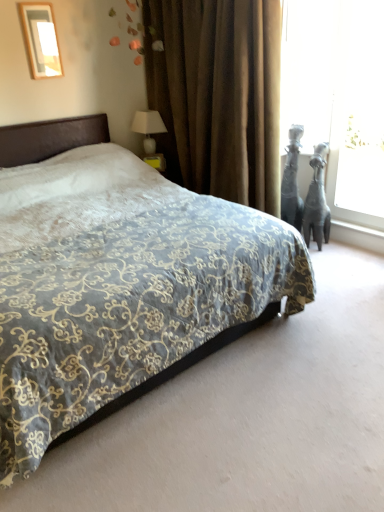
Question: From a real-world perspective, relative to white glossy table lamp at upper right, is black glossy statue at right vertically above or below?

Choices:
 (A) above
 (B) below

Answer: (B)

Question: From the image's perspective, relative to white glossy table lamp at upper right, is black glossy statue at right above or below?

Choices:
 (A) above
 (B) below

Answer: (B)

Question: Which is nearer to the transparent glass window screen at right?

Choices:
 (A) black glossy statue at right
 (B) matte black giraffe at right
 (C) brown velvet curtain at center
 (D) white glossy table lamp at upper right
 (E) velvet-patterned bed at center

Answer: (B)

Question: Estimate the real-world distances between objects in this image. Which object is closer to the black glossy statue at right?

Choices:
 (A) brown velvet curtain at center
 (B) matte black giraffe at right
 (C) transparent glass window screen at right
 (D) white glossy table lamp at upper right
 (E) matte white picture frame at upper left

Answer: (B)